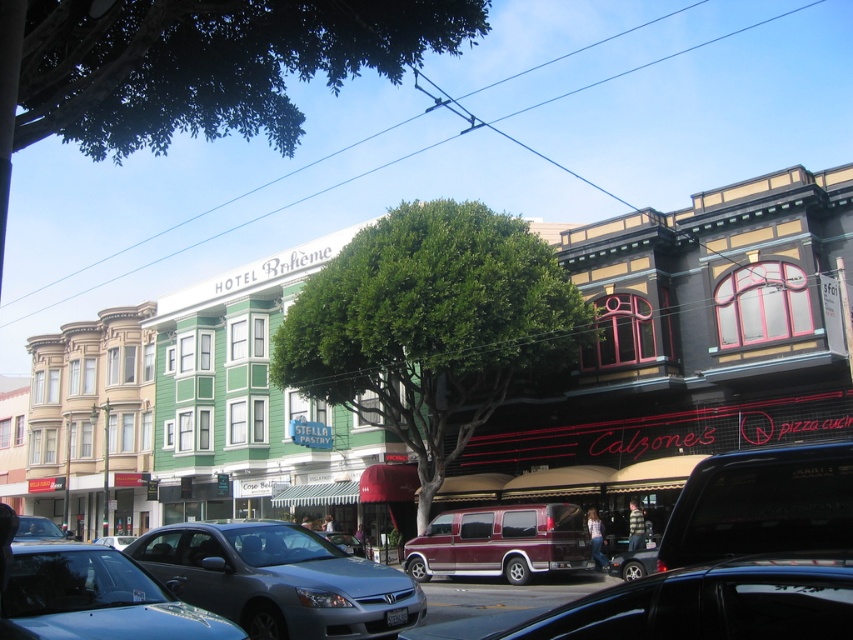
Question: Is green leafy tree at upper center smaller than maroon metallic van at center?

Choices:
 (A) yes
 (B) no

Answer: (B)

Question: Among these points, which one is farthest from the camera?

Choices:
 (A) (469, 324)
 (B) (419, 628)
 (C) (354, 602)

Answer: (A)

Question: Considering the real-world distances, which object is closest to the metallic silver sedan at lower left?

Choices:
 (A) shiny black sedan at center
 (B) green leafy tree at center

Answer: (A)

Question: Is green leafy tree at center to the left of metallic gray sedan at lower left from the viewer's perspective?

Choices:
 (A) yes
 (B) no

Answer: (B)

Question: Which object is farther from the camera taking this photo?

Choices:
 (A) shiny black sedan at center
 (B) satin silver sedan at lower center
 (C) metallic silver sedan at lower left
 (D) maroon metallic van at center

Answer: (D)

Question: Can you confirm if green leafy tree at center is positioned to the left of metallic silver sedan at lower left?

Choices:
 (A) yes
 (B) no

Answer: (B)